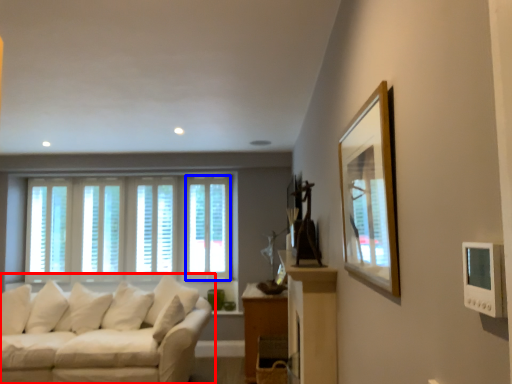
Question: Which object is closer to the camera taking this photo, studio couch (highlighted by a red box) or window (highlighted by a blue box)?

Choices:
 (A) studio couch
 (B) window

Answer: (A)